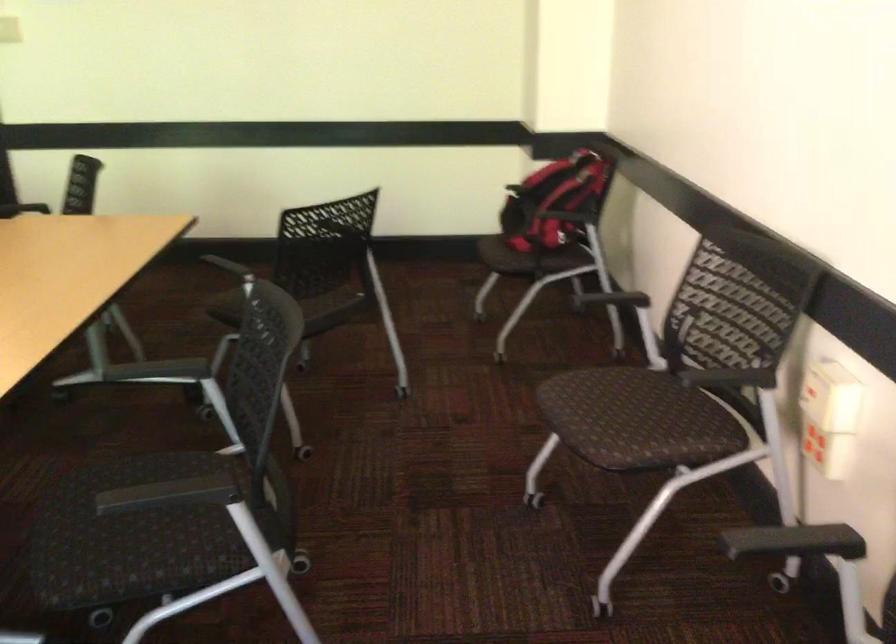
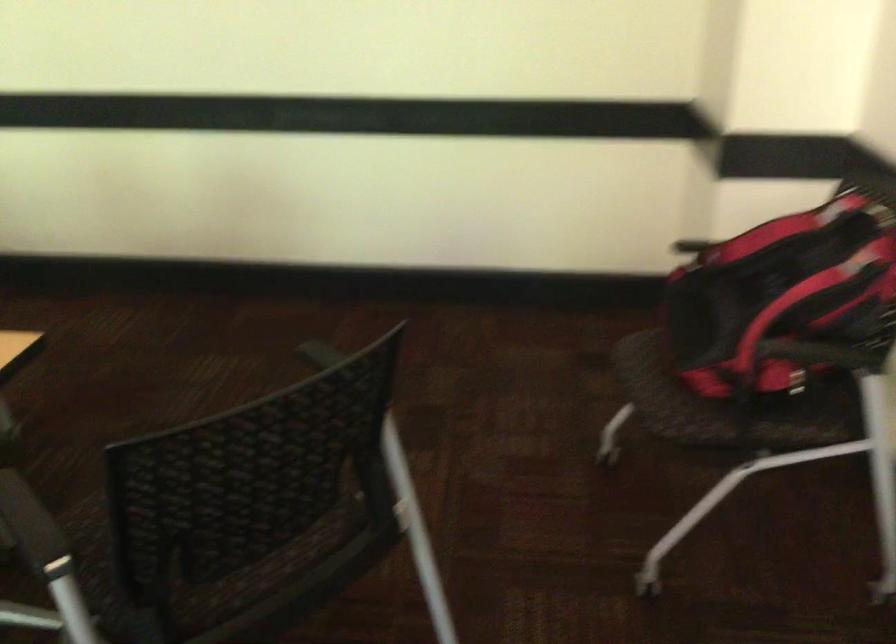
Where in the second image is the point corresponding to point 487,252 from the first image?

(647, 395)